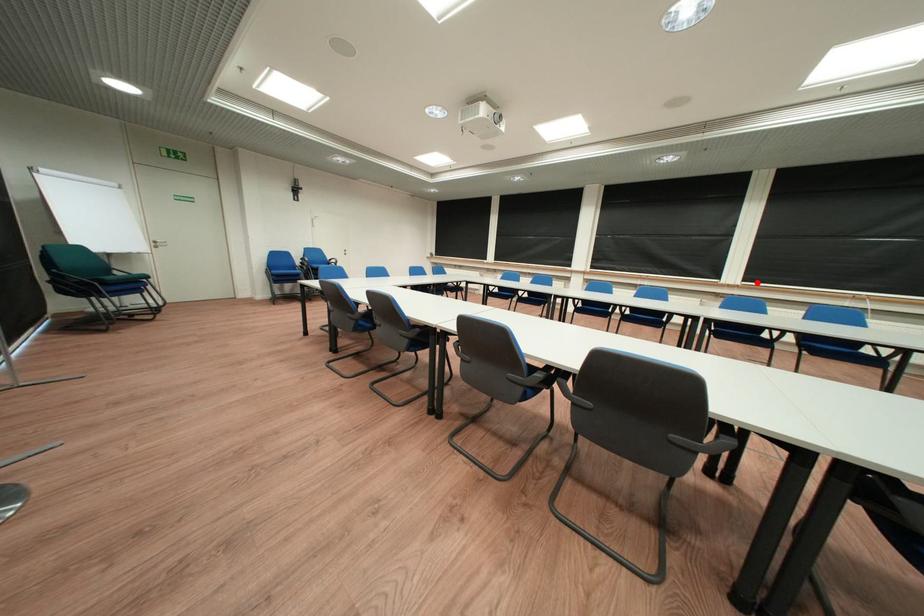
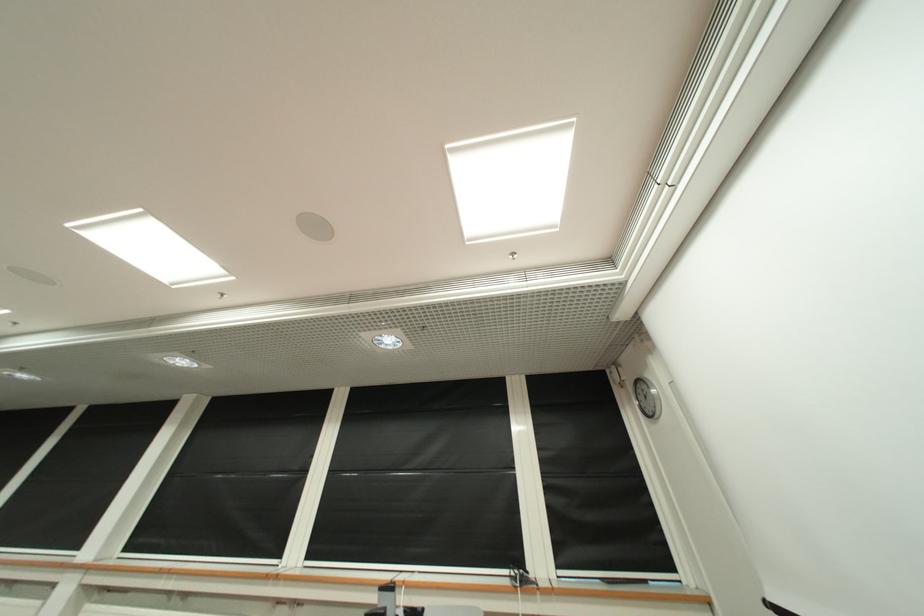
Question: I am providing you with two images of the same scene from different viewpoints. A red point is marked on the first image. Is the red point's position out of view in image 2?

Choices:
 (A) Yes
 (B) No

Answer: (B)